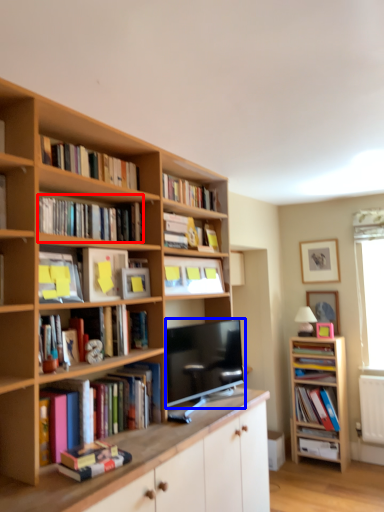
Question: Which object is further to the camera taking this photo, book (highlighted by a red box) or television (highlighted by a blue box)?

Choices:
 (A) book
 (B) television

Answer: (B)